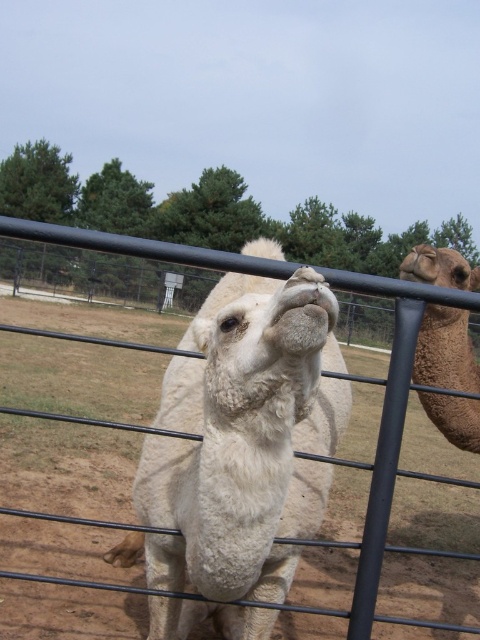
Which of these two, white woolen camel at center or brown fuzzy camel at right, stands taller?

white woolen camel at center

Consider the image. Can you confirm if white woolen camel at center is shorter than brown fuzzy camel at right?

In fact, white woolen camel at center may be taller than brown fuzzy camel at right.

Who is more forward, (239, 348) or (423, 321)?

Point (239, 348) is more forward.

Where is `white woolen camel at center`? The height and width of the screenshot is (640, 480). white woolen camel at center is located at coordinates (241, 440).

Can you confirm if white woolen camel at center is positioned below black metal fence at center?

Correct, white woolen camel at center is located below black metal fence at center.

Who is more distant from viewer, [309,428] or [370,548]?

The point [309,428] is behind.

Who is more distant from viewer, (160, 611) or (396, 291)?

Point (160, 611)

Locate an element on the screen. white woolen camel at center is located at coordinates (241, 440).

Between point (180, 252) and point (429, 268), which one is positioned behind?

The point (429, 268) is more distant.

Is black metal fence at center above brown fuzzy camel at right?

Yes.

Does point (447, 300) come behind point (475, 273)?

No, it is not.

Find the location of a particular element. The width and height of the screenshot is (480, 640). black metal fence at center is located at coordinates (387, 426).